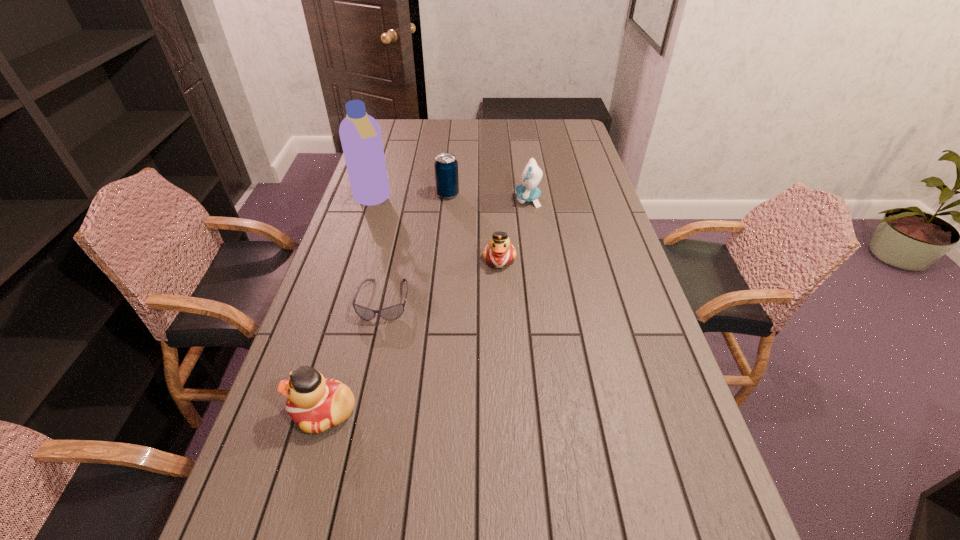
Given the evenly spaced ducks in the image, where should an extra duck be added on the right to preserve the spacing? Please point to a vacant space. Please provide its 2D coordinates. Your answer should be formatted as a tuple, i.e. [(x, y)], where the tuple contains the x and y coordinates of a point satisfying the conditions above.

[(598, 173)]